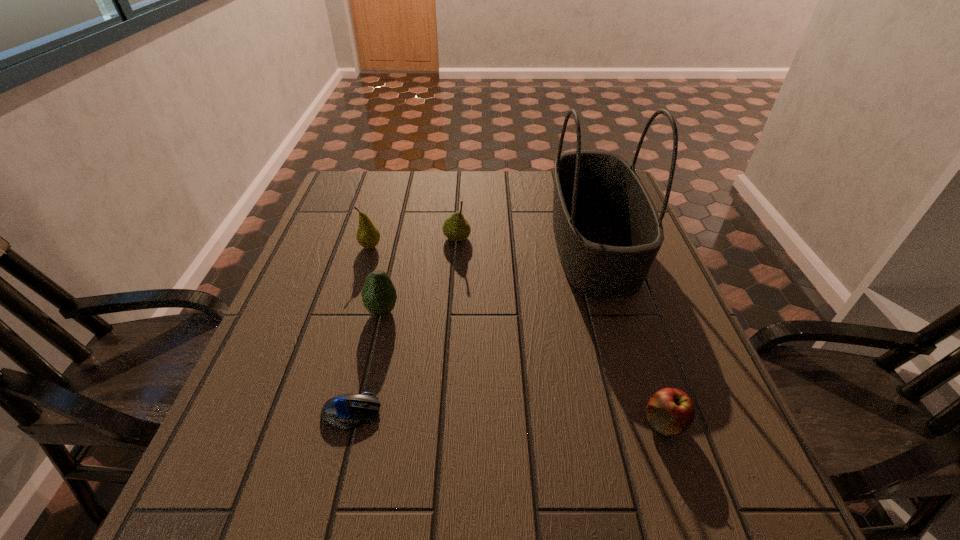
In the image, there is a desktop. Where is `vacant area at the right edge`? vacant area at the right edge is located at coordinates (645, 306).

You are a GUI agent. You are given a task and a screenshot of the screen. Output one action in this format:
    pyautogui.click(x=<x>, y=<y>)
    Task: Click on the vacant space at the far left corner of the desktop
    This screenshot has width=960, height=540.
    Given the screenshot: What is the action you would take?
    pyautogui.click(x=361, y=171)

Locate an element on the screen. This screenshot has height=540, width=960. vacant space at the near right corner is located at coordinates (728, 521).

You are a GUI agent. You are given a task and a screenshot of the screen. Output one action in this format:
    pyautogui.click(x=<x>, y=<y>)
    Task: Click on the empty location between the computer mouse and the left pear
    This screenshot has width=960, height=540.
    Given the screenshot: What is the action you would take?
    pyautogui.click(x=361, y=329)

You are a GUI agent. You are given a task and a screenshot of the screen. Output one action in this format:
    pyautogui.click(x=<x>, y=<y>)
    Task: Click on the free space that is in between the left pear and the basket
    The height and width of the screenshot is (540, 960).
    Given the screenshot: What is the action you would take?
    pyautogui.click(x=482, y=245)

This screenshot has height=540, width=960. I want to click on free spot between the right pear and the avocado, so click(420, 274).

Find the location of a particular element. free space between the computer mouse and the tallest object is located at coordinates [472, 328].

Locate an element on the screen. empty space that is in between the second shortest object and the tallest object is located at coordinates (629, 333).

At what (x,y) coordinates should I click in order to perform the action: click on vacant area between the shortest object and the fifth tallest object. Please return your answer as a coordinate pair (x, y). Image resolution: width=960 pixels, height=540 pixels. Looking at the image, I should click on (508, 417).

Where is `empty location between the computer mouse and the left pear`? empty location between the computer mouse and the left pear is located at coordinates (361, 329).